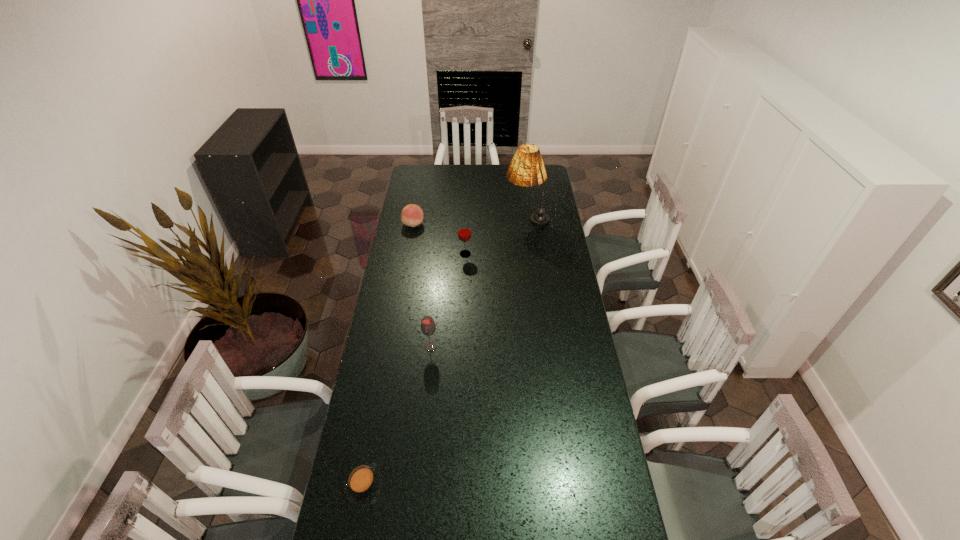
Where is `free space located on the front-facing side of the tallest object`? free space located on the front-facing side of the tallest object is located at coordinates 449,218.

This screenshot has width=960, height=540. In order to click on free space located 0.330m on the front-facing side of the tallest object in this screenshot , I will do `click(442, 218)`.

At what (x,y) coordinates should I click in order to perform the action: click on vacant space located on the back of the right glass drink container. Please return your answer as a coordinate pair (x, y). The height and width of the screenshot is (540, 960). Looking at the image, I should click on (467, 213).

Identify the location of vacant area situated 0.340m on the right of the fourth farthest object. (523, 346).

I want to click on free space located 0.200m on the back of the second shortest object, so click(x=419, y=196).

Identify the location of free space located on the front of the cappuccino. Image resolution: width=960 pixels, height=540 pixels. 355,536.

In order to click on peach located at the left edge in this screenshot , I will do `click(412, 215)`.

This screenshot has width=960, height=540. I want to click on cappuccino at the left edge, so click(x=364, y=484).

In order to click on object at the right edge in this screenshot , I will do `click(526, 169)`.

This screenshot has width=960, height=540. I want to click on vacant space at the far edge, so click(479, 164).